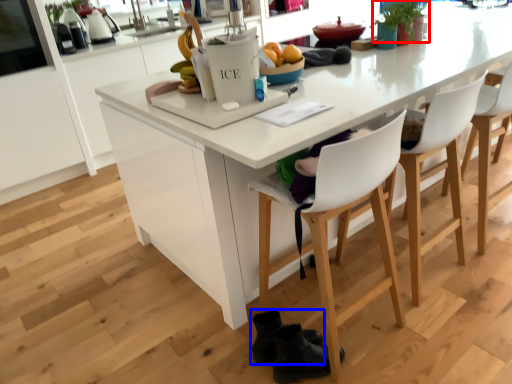
Question: Which of the following is the closest to the observer, plant (highlighted by a red box) or footwear (highlighted by a blue box)?

Choices:
 (A) plant
 (B) footwear

Answer: (B)